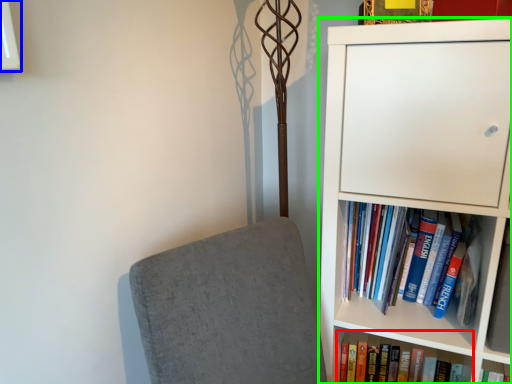
Question: Which object is the closest to the book (highlighted by a red box)? Choose among these: window (highlighted by a blue box) or bookcase (highlighted by a green box).

Choices:
 (A) window
 (B) bookcase

Answer: (B)